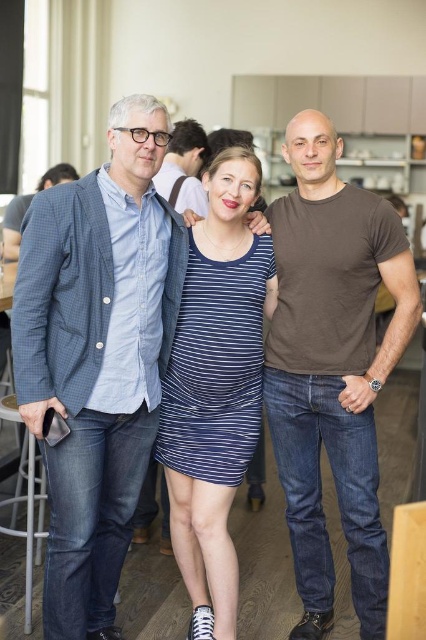
Does blue checkered blazer at left have a larger size compared to blue striped dress at center?

Yes, blue checkered blazer at left is bigger than blue striped dress at center.

Does blue checkered blazer at left appear under blue striped dress at center?

→ No, blue checkered blazer at left is not below blue striped dress at center.

Which is behind, point (78, 456) or point (216, 157)?

The point (216, 157) is more distant.

At what (x,y) coordinates should I click in order to perform the action: click on blue checkered blazer at left. Please return your answer as a coordinate pair (x, y). The image size is (426, 640). Looking at the image, I should click on (97, 356).

Can you confirm if blue checkered blazer at left is positioned to the right of metallic silver stool at lower left?

Yes, blue checkered blazer at left is to the right of metallic silver stool at lower left.

The image size is (426, 640). Find the location of `blue checkered blazer at left`. blue checkered blazer at left is located at coordinates (97, 356).

Does point (55, 586) come farther from viewer compared to point (193, 154)?

No, it is not.

The image size is (426, 640). What do you see at coordinates (97, 356) in the screenshot? I see `blue checkered blazer at left` at bounding box center [97, 356].

You are a GUI agent. You are given a task and a screenshot of the screen. Output one action in this format:
    pyautogui.click(x=<x>, y=<y>)
    Task: Click on the blue checkered blazer at left
    
    Given the screenshot: What is the action you would take?
    pos(97,356)